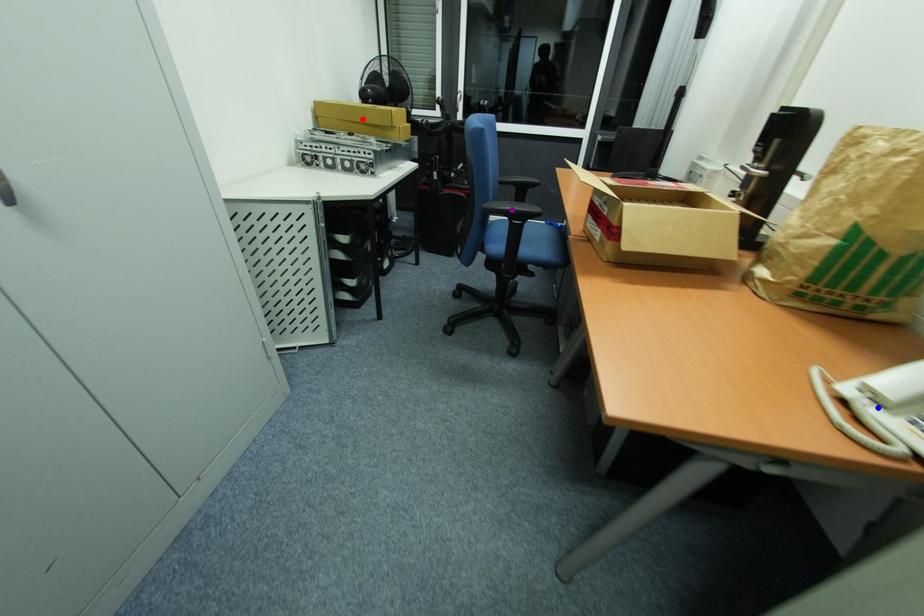
Order these from nearest to farthest:
1. red point
2. blue point
3. purple point

red point, purple point, blue point